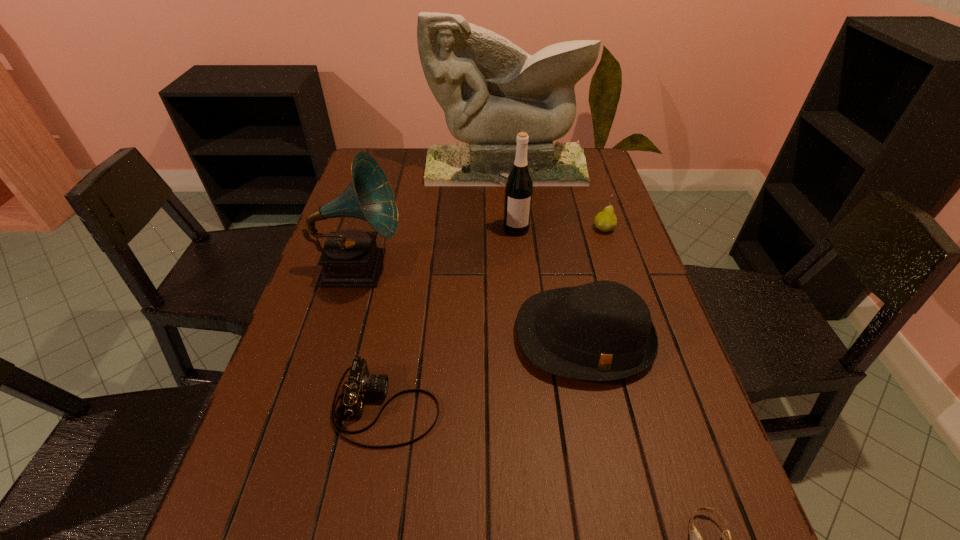
This screenshot has height=540, width=960. Find the location of `free space located 0.160m on the front-facing side of the fedora`. free space located 0.160m on the front-facing side of the fedora is located at coordinates (612, 465).

The height and width of the screenshot is (540, 960). Identify the location of free region located on the left of the pear. coord(495,228).

At what (x,y) coordinates should I click in order to perform the action: click on vacant space located 0.050m on the front-facing side of the sixth tallest object. Please return your answer as a coordinate pair (x, y). This screenshot has height=540, width=960. Looking at the image, I should click on (465, 407).

The height and width of the screenshot is (540, 960). In order to click on object at the far edge in this screenshot , I will do `click(490, 89)`.

The height and width of the screenshot is (540, 960). Find the location of `phonograph_record present at the left edge`. phonograph_record present at the left edge is located at coordinates (350, 258).

I want to click on camera at the left edge, so click(360, 383).

The image size is (960, 540). I want to click on sculpture present at the right edge, so click(x=490, y=89).

Locate an element on the screen. Image resolution: width=960 pixels, height=540 pixels. fedora at the right edge is located at coordinates (600, 331).

I want to click on pear that is at the right edge, so click(606, 220).

Locate an element on the screen. This screenshot has width=960, height=540. object at the far right corner is located at coordinates (490, 89).